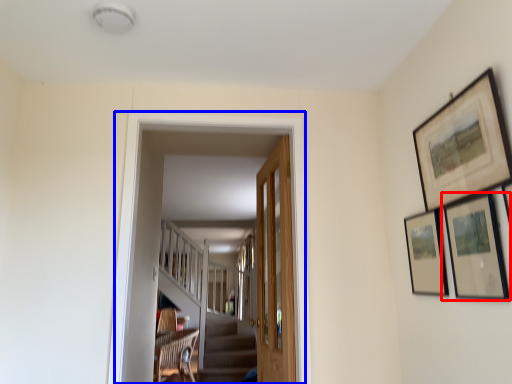
Question: Among these objects, which one is farthest to the camera, picture frame (highlighted by a red box) or corridor (highlighted by a blue box)?

Choices:
 (A) picture frame
 (B) corridor

Answer: (B)